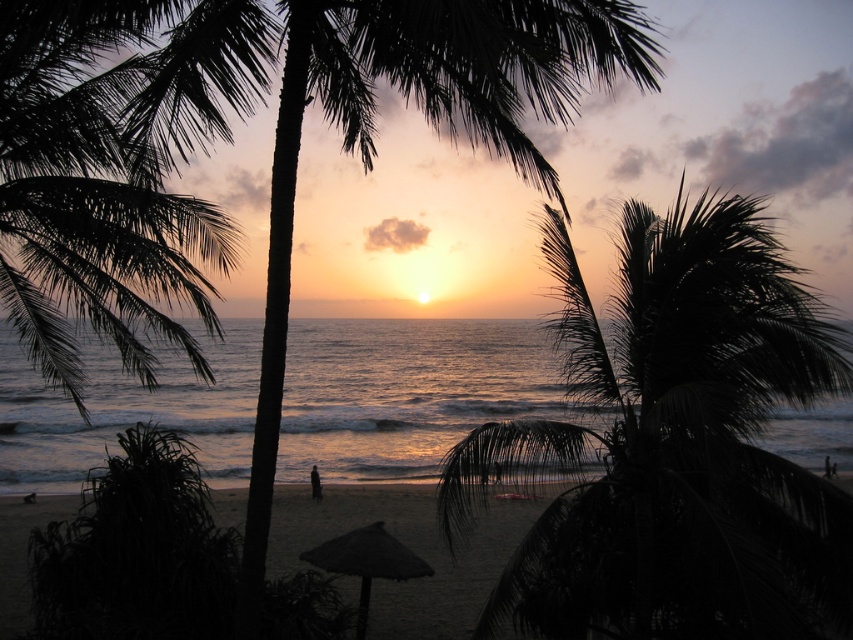
Question: Where is dark green leafy palm tree at center located in relation to dark green leafy palm tree at left in the image?

Choices:
 (A) above
 (B) below

Answer: (B)

Question: Which point is farther to the camera?

Choices:
 (A) brown thatched umbrella at center
 (B) dark sand at lower center

Answer: (B)

Question: Which point is closer to the camera?

Choices:
 (A) dark sand at lower center
 (B) golden reflective water at center
 (C) brown thatched umbrella at center

Answer: (C)

Question: Among these points, which one is nearest to the camera?

Choices:
 (A) (373, 524)
 (B) (494, 576)
 (C) (635, 589)

Answer: (C)

Question: Does dark green leafy palm tree at center appear on the left side of golden reflective water at center?

Choices:
 (A) no
 (B) yes

Answer: (A)

Question: Is golden reflective water at center bigger than dark green leafy palm tree at left?

Choices:
 (A) no
 (B) yes

Answer: (B)